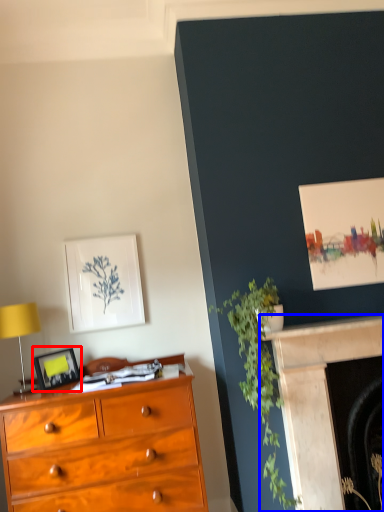
Question: Among these objects, which one is nearest to the camera, picture frame (highlighted by a red box) or fireplace (highlighted by a blue box)?

Choices:
 (A) picture frame
 (B) fireplace

Answer: (B)